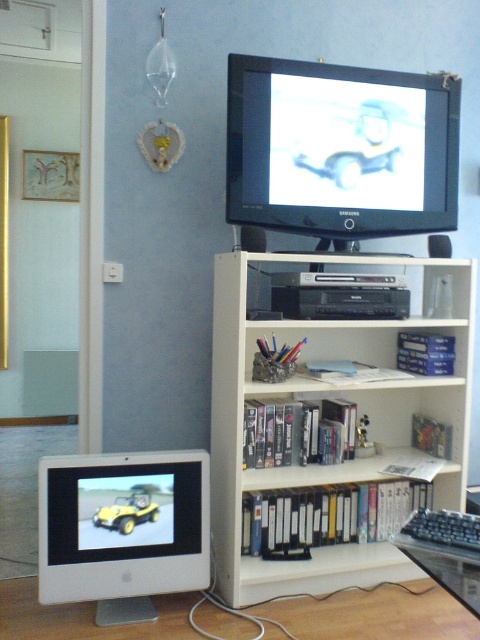
Who is taller, white wood bookshelf at center or matte black monitor at upper center?

white wood bookshelf at center

Is white wood bookshelf at center below matte black monitor at upper center?

Yes.

Locate an element on the screen. This screenshot has height=640, width=480. white wood bookshelf at center is located at coordinates (334, 433).

Can you confirm if white glossy computer monitor at lower left is positioned to the left of yellow matte toy car at center?

Yes, white glossy computer monitor at lower left is to the left of yellow matte toy car at center.

Which is in front, point (91, 512) or point (104, 515)?

Point (91, 512)

At what (x,y) coordinates should I click in order to perform the action: click on white glossy computer monitor at lower left. Please return your answer as a coordinate pair (x, y). The image size is (480, 640). Looking at the image, I should click on (122, 529).

Can you confirm if matte black monitor at upper center is bigger than yellow matte toy car at center?

Yes.

Is point (354, 134) closer to camera compared to point (132, 508)?

No.

Image resolution: width=480 pixels, height=640 pixels. In order to click on matte black monitor at upper center in this screenshot , I will do `click(340, 148)`.